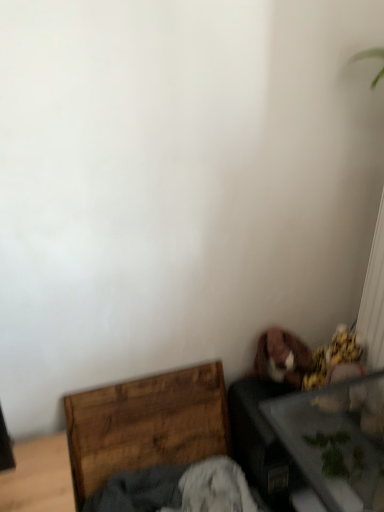
Question: From the image's perspective, does transparent glass table at lower right appear lower than wooden crate at lower left?

Choices:
 (A) no
 (B) yes

Answer: (B)

Question: Is wooden crate at lower left completely or partially inside transparent glass table at lower right?

Choices:
 (A) no
 (B) yes

Answer: (A)

Question: From a real-world perspective, does transparent glass table at lower right sit lower than wooden crate at lower left?

Choices:
 (A) no
 (B) yes

Answer: (A)

Question: Does transparent glass table at lower right have a greater height compared to wooden crate at lower left?

Choices:
 (A) no
 (B) yes

Answer: (B)

Question: Does transparent glass table at lower right appear on the left side of wooden crate at lower left?

Choices:
 (A) yes
 (B) no

Answer: (B)

Question: Is the surface of transparent glass table at lower right in direct contact with wooden crate at lower left?

Choices:
 (A) no
 (B) yes

Answer: (A)

Question: Would you say wooden crate at lower left is a long distance from transparent glass table at lower right?

Choices:
 (A) yes
 (B) no

Answer: (B)

Question: Would you say wooden crate at lower left contains transparent glass table at lower right?

Choices:
 (A) no
 (B) yes

Answer: (A)

Question: Considering the relative sizes of wooden crate at lower left and transparent glass table at lower right in the image provided, is wooden crate at lower left bigger than transparent glass table at lower right?

Choices:
 (A) no
 (B) yes

Answer: (A)

Question: Does wooden crate at lower left have a greater width compared to transparent glass table at lower right?

Choices:
 (A) no
 (B) yes

Answer: (A)

Question: Is wooden crate at lower left to the right of transparent glass table at lower right from the viewer's perspective?

Choices:
 (A) yes
 (B) no

Answer: (B)

Question: From the image's perspective, is wooden crate at lower left located above transparent glass table at lower right?

Choices:
 (A) no
 (B) yes

Answer: (B)

Question: From the image's perspective, is transparent glass table at lower right located above or below wooden crate at lower left?

Choices:
 (A) above
 (B) below

Answer: (B)